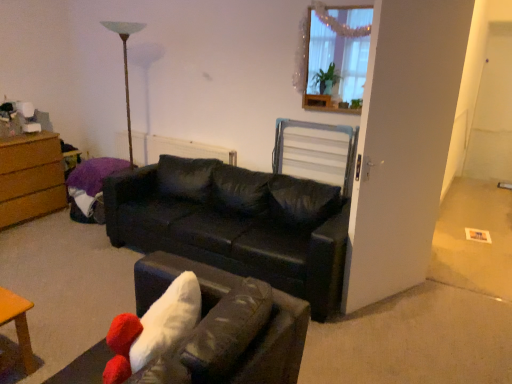
I want to click on vacant space to the right of brown wood chest of drawers at left, so click(57, 226).